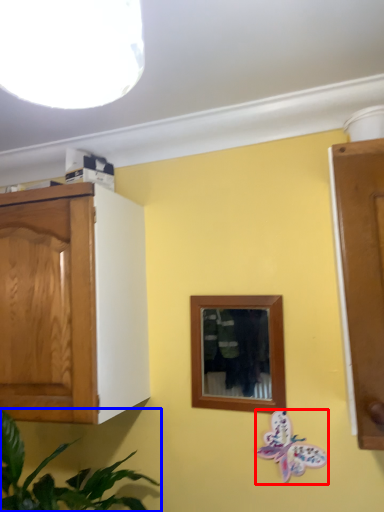
Question: Among these objects, which one is nearest to the camera, butterfly (highlighted by a red box) or houseplant (highlighted by a blue box)?

Choices:
 (A) butterfly
 (B) houseplant

Answer: (B)